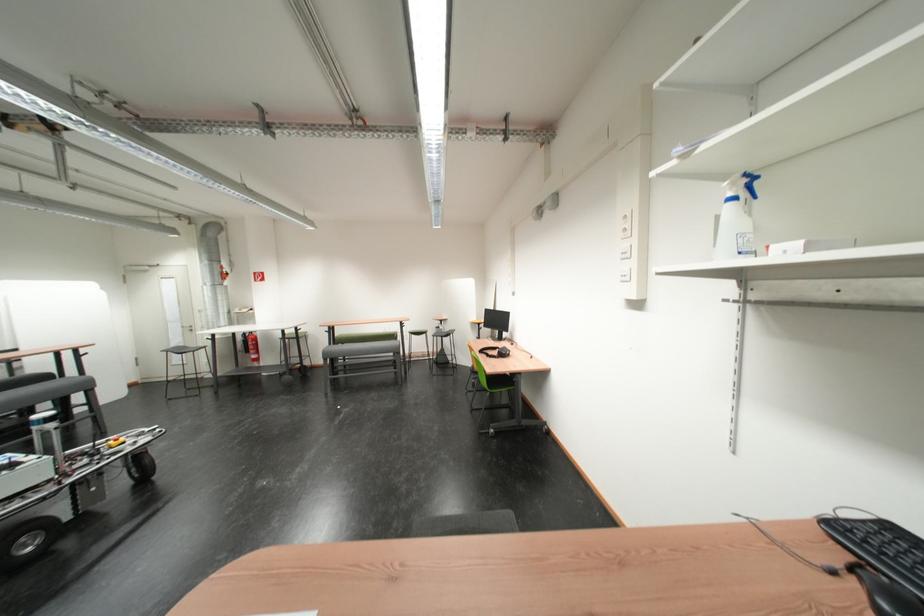
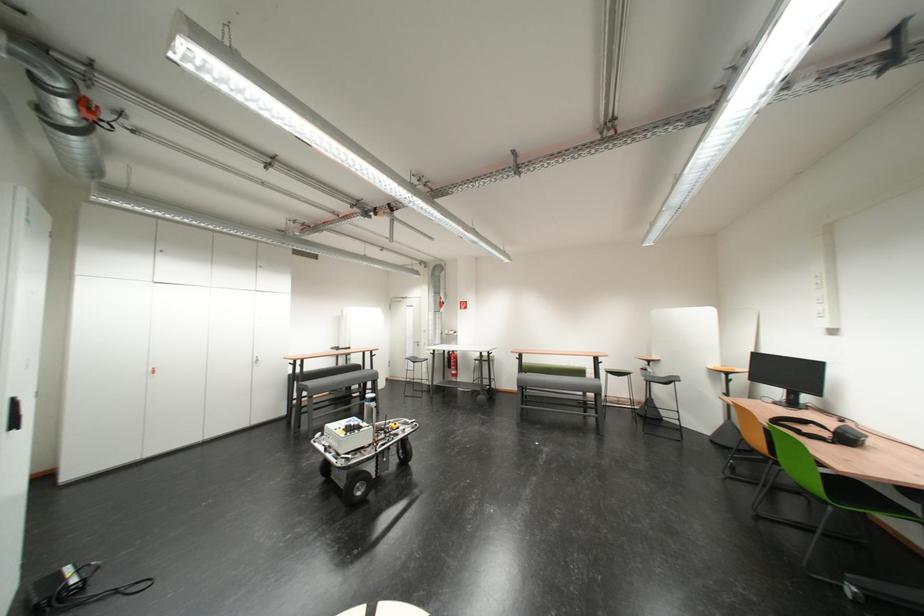
Where in the second image is the point corresponding to (242,338) from the first image?

(454, 354)